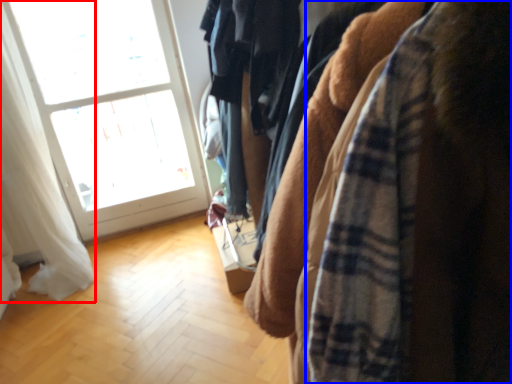
Question: Which object is further to the camera taking this photo, curtain (highlighted by a red box) or flannel (highlighted by a blue box)?

Choices:
 (A) curtain
 (B) flannel

Answer: (A)